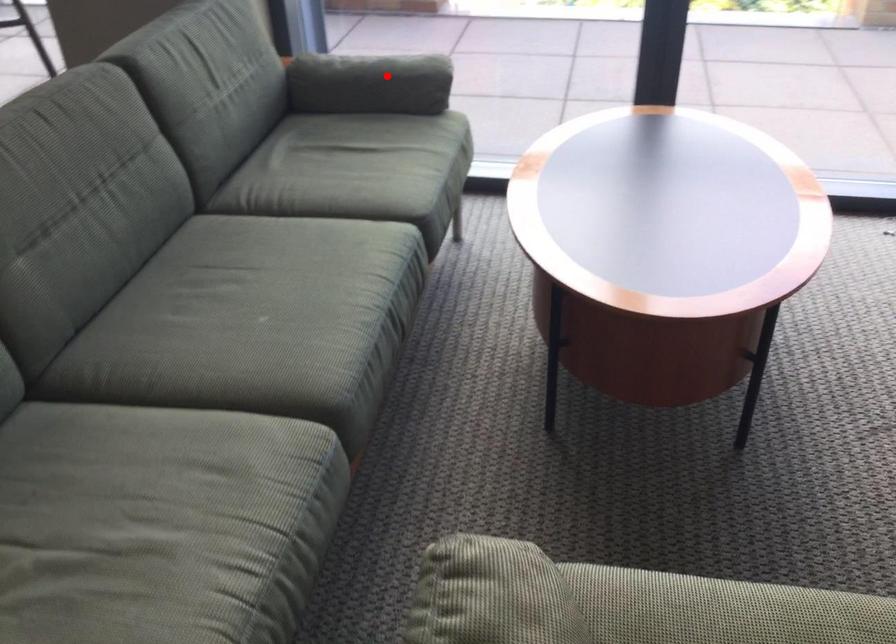
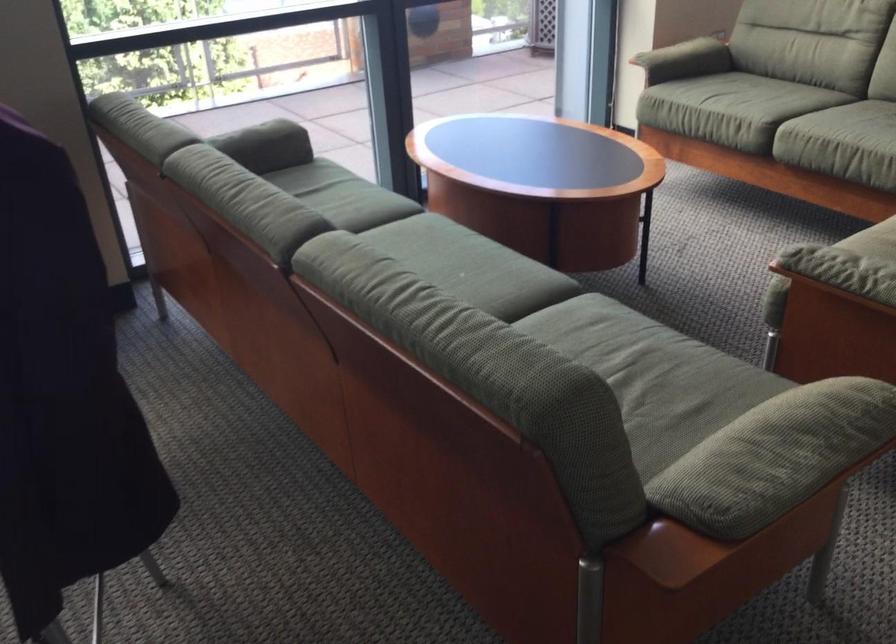
Locate, in the second image, the point that corresponds to the highlighted location in the first image.

(265, 140)